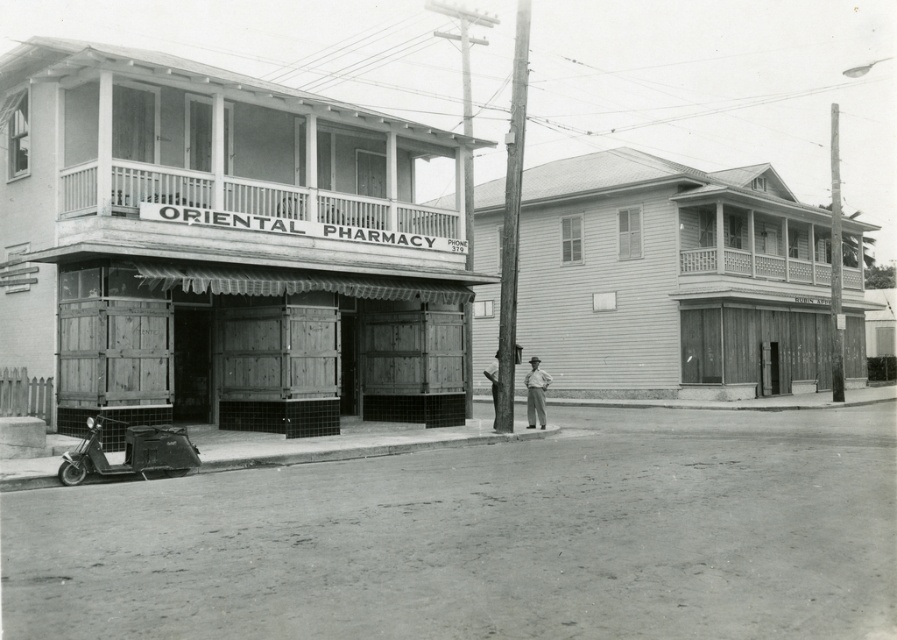
Question: Which object is the closest to the metallic silver scooter at lower left?

Choices:
 (A) smooth wooden pole at center right
 (B) light brown wooden man at center

Answer: (B)

Question: Which point is closer to the camera taking this photo?

Choices:
 (A) (527, 376)
 (B) (138, 442)
 (C) (507, 356)
 (D) (835, 385)

Answer: (B)

Question: Is wooden/wooden-textured store at left positioned in front of metallic silver scooter at lower left?

Choices:
 (A) no
 (B) yes

Answer: (A)

Question: Among these points, which one is nearest to the camera?

Choices:
 (A) (540, 298)
 (B) (541, 420)

Answer: (B)

Question: Is the position of wooden/wooden-textured store at left less distant than that of light brown wooden man at center?

Choices:
 (A) no
 (B) yes

Answer: (B)

Question: Can you confirm if wooden pole at center is wider than light brown wooden hat at center?

Choices:
 (A) yes
 (B) no

Answer: (A)